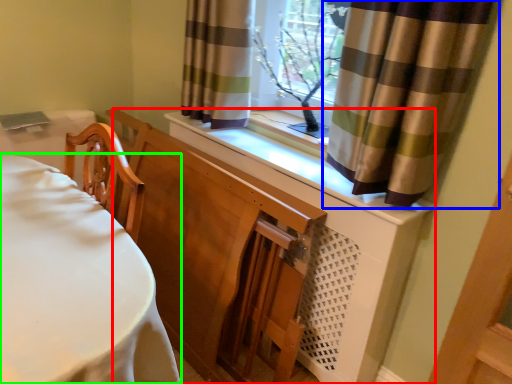
Question: Which object is positioned farthest from dresser (highlighted by a red box)? Select from curtain (highlighted by a blue box) and furniture (highlighted by a green box).

Choices:
 (A) curtain
 (B) furniture

Answer: (B)